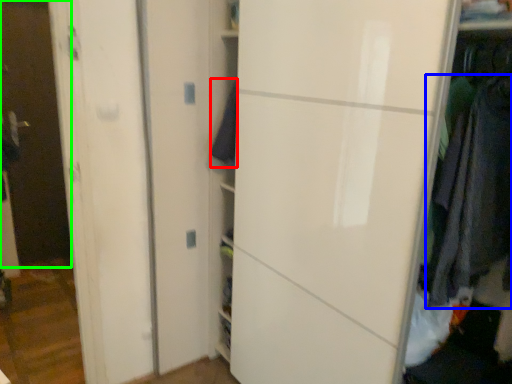
Question: Estimate the real-world distances between objects in this image. Which object is closer to clothing (highlighted by a red box), clothing (highlighted by a blue box) or glass door (highlighted by a green box)?

Choices:
 (A) clothing
 (B) glass door

Answer: (A)